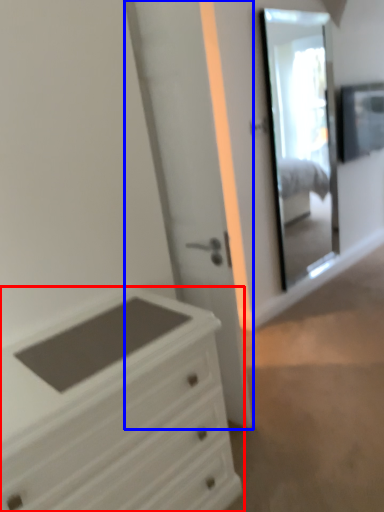
Question: Which point is closer to the camera, chest of drawers (highlighted by a red box) or door (highlighted by a blue box)?

Choices:
 (A) chest of drawers
 (B) door

Answer: (A)